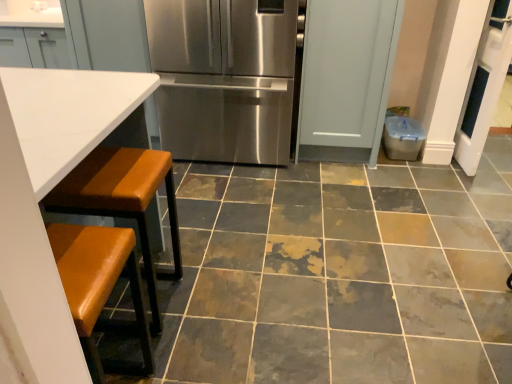
You are a GUI agent. You are given a task and a screenshot of the screen. Output one action in this format:
    pyautogui.click(x=<x>, y=<y>)
    Task: Click on the free spot in front of stainless steel refrigerator at center
    The width and height of the screenshot is (512, 384).
    Given the screenshot: What is the action you would take?
    pyautogui.click(x=243, y=203)